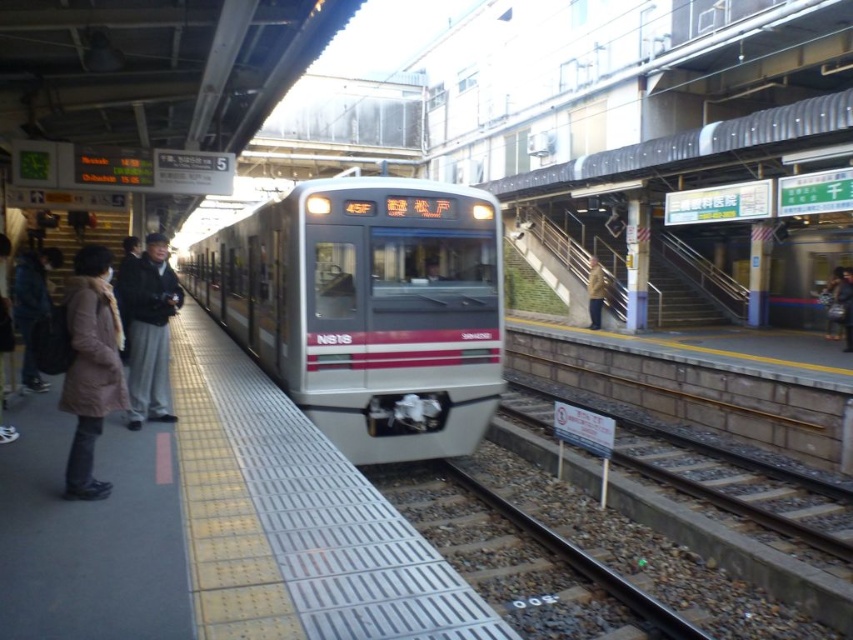
Which is behind, point (161, 289) or point (598, 310)?

Positioned behind is point (598, 310).

Is point (125, 300) in front of point (602, 285)?

Yes, point (125, 300) is in front of point (602, 285).

Measure the distance between point (x=155, y=412) and camera.

Point (x=155, y=412) is 6.62 meters from camera.

Image resolution: width=853 pixels, height=640 pixels. In order to click on dark gray fabric jacket at left in this screenshot , I will do `click(149, 330)`.

Is silver metallic train at center wider than dark gray fabric jacket at left?

Correct, the width of silver metallic train at center exceeds that of dark gray fabric jacket at left.

Does silver metallic train at center have a greater height compared to dark gray fabric jacket at left?

Correct, silver metallic train at center is much taller as dark gray fabric jacket at left.

Who is more distant from viewer, (393, 397) or (126, 288)?

Positioned behind is point (393, 397).

You are a GUI agent. You are given a task and a screenshot of the screen. Output one action in this format:
    pyautogui.click(x=<x>, y=<y>)
    Task: Click on the silver metallic train at center
    The height and width of the screenshot is (640, 853).
    Given the screenshot: What is the action you would take?
    pyautogui.click(x=368, y=308)

Describe the element at coordinates (368, 308) in the screenshot. The image size is (853, 640). I see `silver metallic train at center` at that location.

This screenshot has height=640, width=853. What do you see at coordinates (368, 308) in the screenshot?
I see `silver metallic train at center` at bounding box center [368, 308].

Image resolution: width=853 pixels, height=640 pixels. In order to click on silver metallic train at center in this screenshot , I will do coord(368,308).